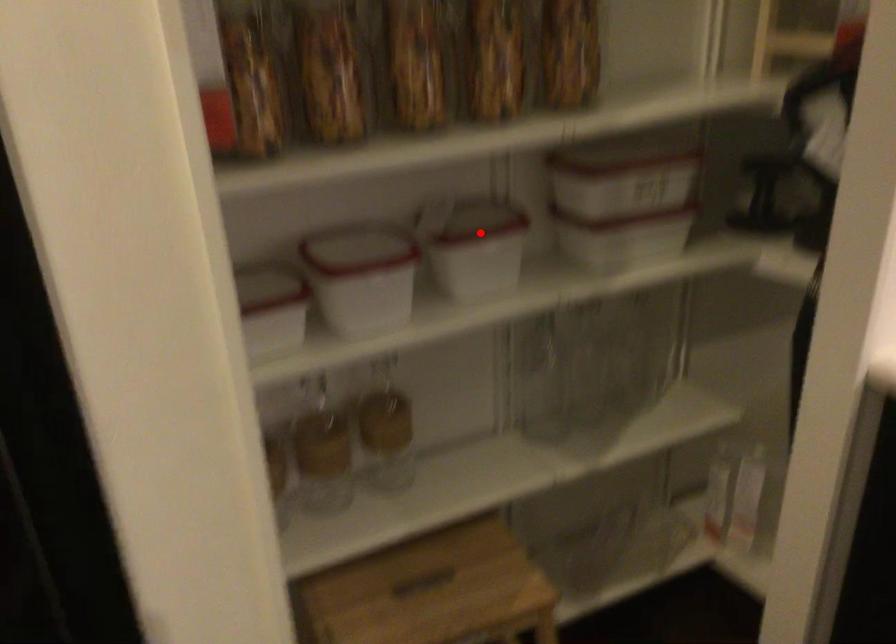
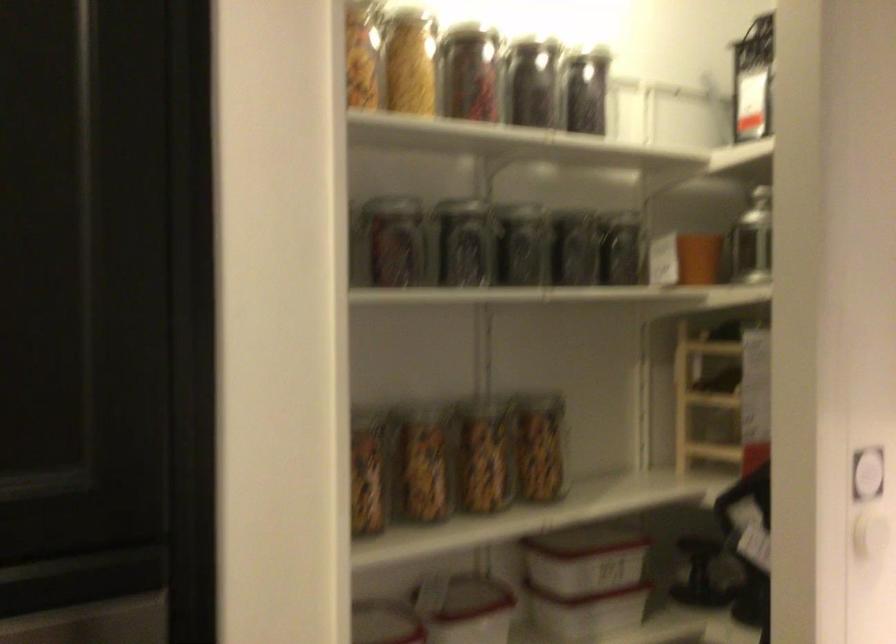
Question: I am providing you with two images of the same scene from different viewpoints. In image1, a red point is highlighted. Considering the same 3D point in image2, which of the following is correct?

Choices:
 (A) It is closer
 (B) It is farther

Answer: (B)